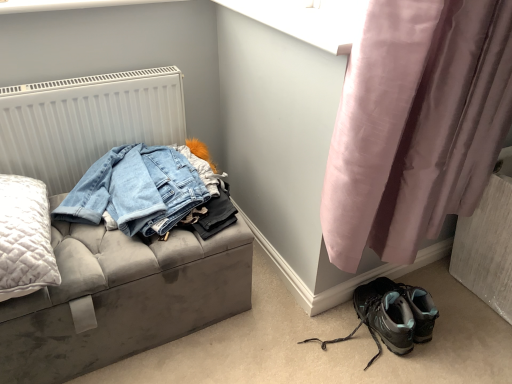
Question: Is velvet grey storage bench at left bigger than pink satin curtain at lower right?

Choices:
 (A) yes
 (B) no

Answer: (A)

Question: Is velvet grey storage bench at left thinner than pink satin curtain at lower right?

Choices:
 (A) yes
 (B) no

Answer: (B)

Question: Considering the relative sizes of velvet grey storage bench at left and pink satin curtain at lower right in the image provided, is velvet grey storage bench at left smaller than pink satin curtain at lower right?

Choices:
 (A) no
 (B) yes

Answer: (A)

Question: Would you say pink satin curtain at lower right is part of velvet grey storage bench at left's contents?

Choices:
 (A) no
 (B) yes

Answer: (A)

Question: Is velvet grey storage bench at left directly adjacent to pink satin curtain at lower right?

Choices:
 (A) yes
 (B) no

Answer: (B)

Question: Is velvet grey storage bench at left oriented towards pink satin curtain at lower right?

Choices:
 (A) no
 (B) yes

Answer: (A)

Question: Is velvet grey storage bench at left far from white textured radiator at upper left?

Choices:
 (A) yes
 (B) no

Answer: (B)

Question: Does velvet grey storage bench at left appear on the left side of white textured radiator at upper left?

Choices:
 (A) yes
 (B) no

Answer: (B)

Question: Is velvet grey storage bench at left surrounding white textured radiator at upper left?

Choices:
 (A) no
 (B) yes

Answer: (A)

Question: From the image's perspective, is velvet grey storage bench at left beneath white textured radiator at upper left?

Choices:
 (A) no
 (B) yes

Answer: (B)

Question: From a real-world perspective, is velvet grey storage bench at left over white textured radiator at upper left?

Choices:
 (A) yes
 (B) no

Answer: (B)

Question: Does velvet grey storage bench at left have a lesser width compared to white textured radiator at upper left?

Choices:
 (A) yes
 (B) no

Answer: (B)

Question: Is matte black hiking boots at lower right shorter than velvet grey storage bench at left?

Choices:
 (A) no
 (B) yes

Answer: (B)